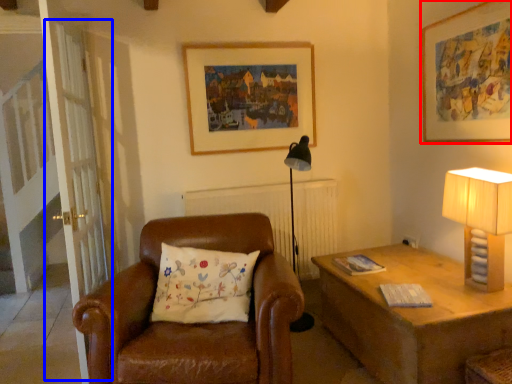
Question: Which object appears closest to the camera in this image, picture frame (highlighted by a red box) or screen door (highlighted by a blue box)?

Choices:
 (A) picture frame
 (B) screen door

Answer: (A)